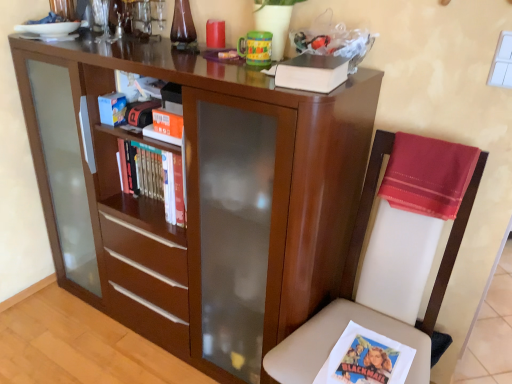
Where is `vacant point to the left of hardcover book at upper center`? The height and width of the screenshot is (384, 512). vacant point to the left of hardcover book at upper center is located at coordinates (242, 82).